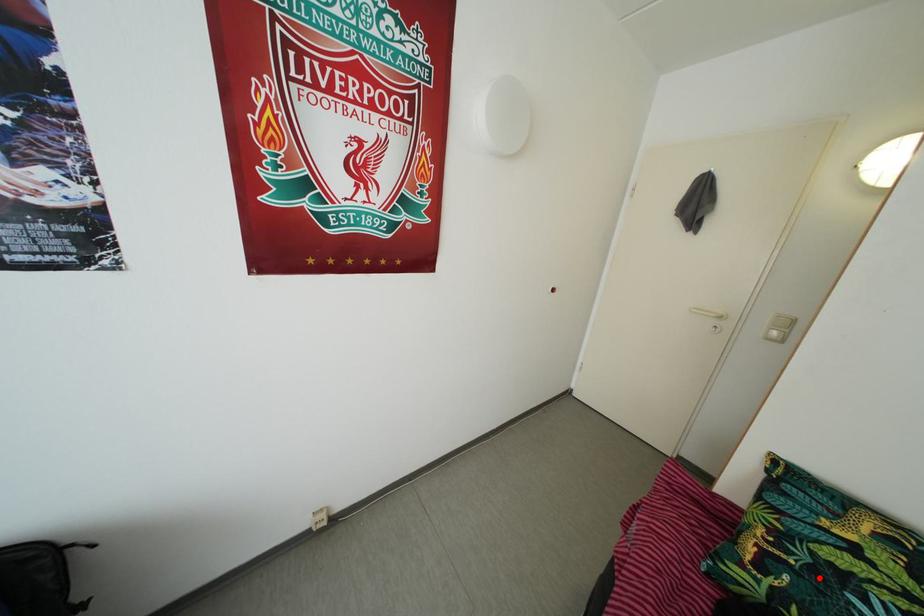
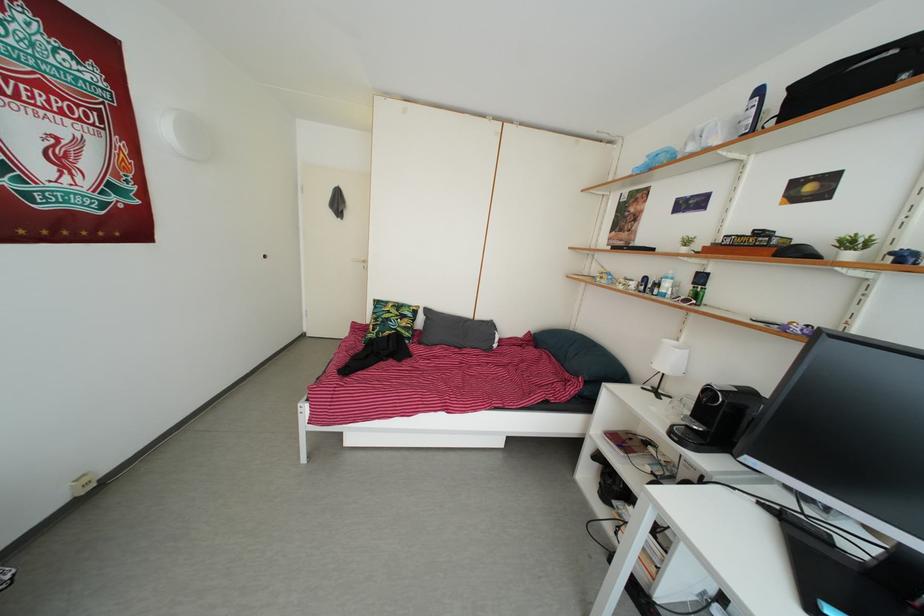
Question: I am providing you with two images of the same scene from different viewpoints. In image1, a red point is highlighted. Considering the same 3D point in image2, which of the following is correct?

Choices:
 (A) It is closer
 (B) It is farther

Answer: (B)